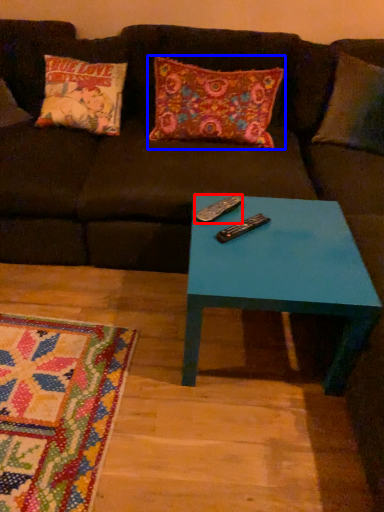
Question: Which object is closer to the camera taking this photo, remote (highlighted by a red box) or pillow (highlighted by a blue box)?

Choices:
 (A) remote
 (B) pillow

Answer: (A)